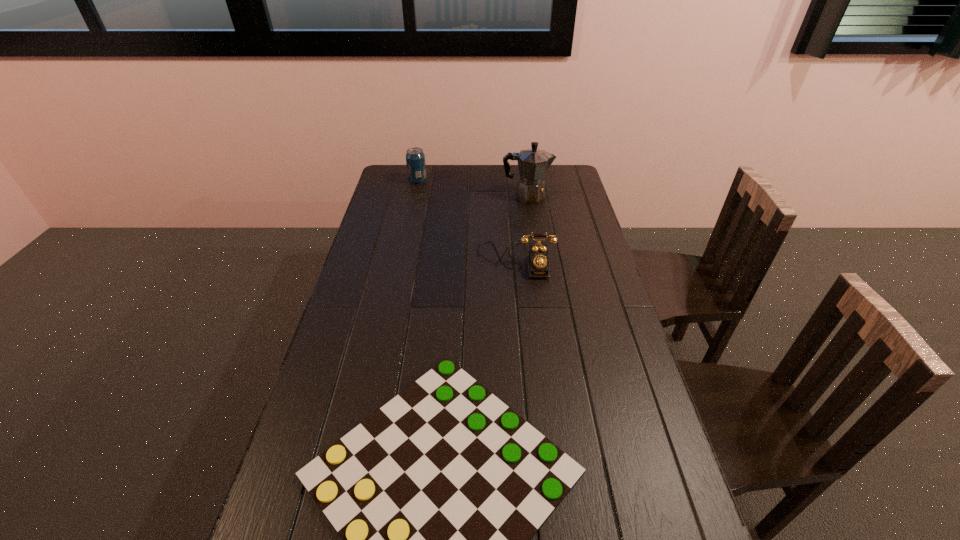
The height and width of the screenshot is (540, 960). I want to click on object at the left edge, so click(x=415, y=158).

The image size is (960, 540). Find the location of `object that is at the right edge`. object that is at the right edge is located at coordinates (533, 163).

The height and width of the screenshot is (540, 960). Identify the location of object present at the far left corner. (415, 158).

This screenshot has width=960, height=540. Identify the location of object that is at the far right corner. (533, 163).

Identify the location of free space at the far edge of the desktop. (453, 169).

The width and height of the screenshot is (960, 540). What are the coordinates of `free space at the left edge of the desktop` in the screenshot? It's located at (403, 231).

Find the location of `free point at the right edge`. free point at the right edge is located at coordinates (587, 226).

In the image, there is a desktop. Find the location of `vacant space at the far right corner`. vacant space at the far right corner is located at coordinates (555, 166).

Find the location of `vacant area that lies between the farthest object and the second shortest object`. vacant area that lies between the farthest object and the second shortest object is located at coordinates (467, 220).

Identify the location of free spot between the tallest object and the second nearest object. This screenshot has width=960, height=540. (521, 228).